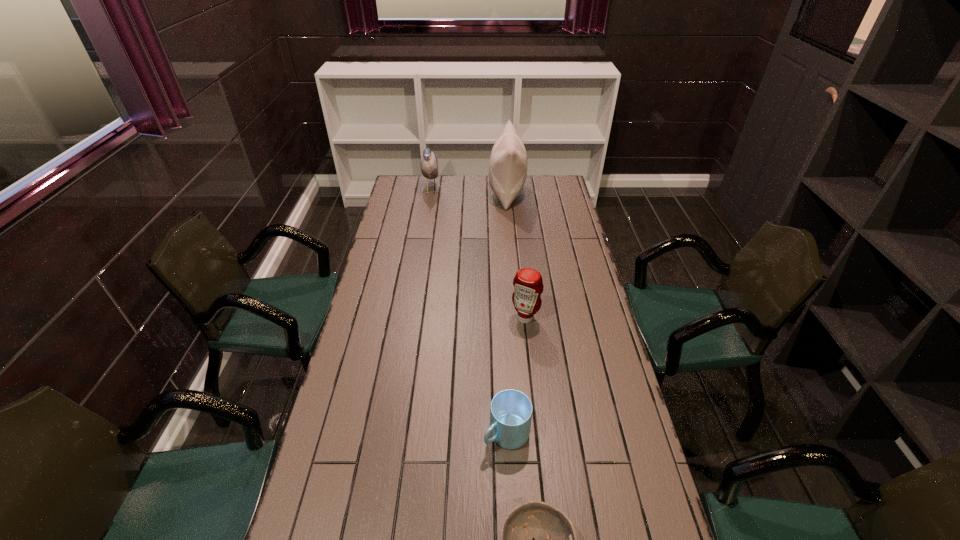
The height and width of the screenshot is (540, 960). Identify the location of vacant space at the far right corner of the desktop. (546, 195).

Find the location of a particular element. Image resolution: width=960 pixels, height=540 pixels. free point between the mug and the condiment is located at coordinates coord(516,376).

At what (x,y) coordinates should I click in order to perform the action: click on free space between the tallest object and the condiment. Please return your answer as a coordinate pair (x, y). Image resolution: width=960 pixels, height=540 pixels. Looking at the image, I should click on (516, 255).

Locate an element on the screen. The image size is (960, 540). vacant space that is in between the third farthest object and the leftmost object is located at coordinates (478, 254).

Where is `free space between the bird and the fourth tallest object`? This screenshot has height=540, width=960. free space between the bird and the fourth tallest object is located at coordinates (468, 312).

Identify the location of free point between the tallest object and the bird. (468, 192).

This screenshot has height=540, width=960. I want to click on empty space that is in between the fourth tallest object and the tallest object, so click(507, 314).

This screenshot has width=960, height=540. Find the location of `free spot between the condiment and the leftmost object`. free spot between the condiment and the leftmost object is located at coordinates (478, 254).

Where is `the fourth closest object relative to the cushion`? The height and width of the screenshot is (540, 960). the fourth closest object relative to the cushion is located at coordinates (555, 536).

I want to click on the second closest object to the fourth tallest object, so click(528, 285).